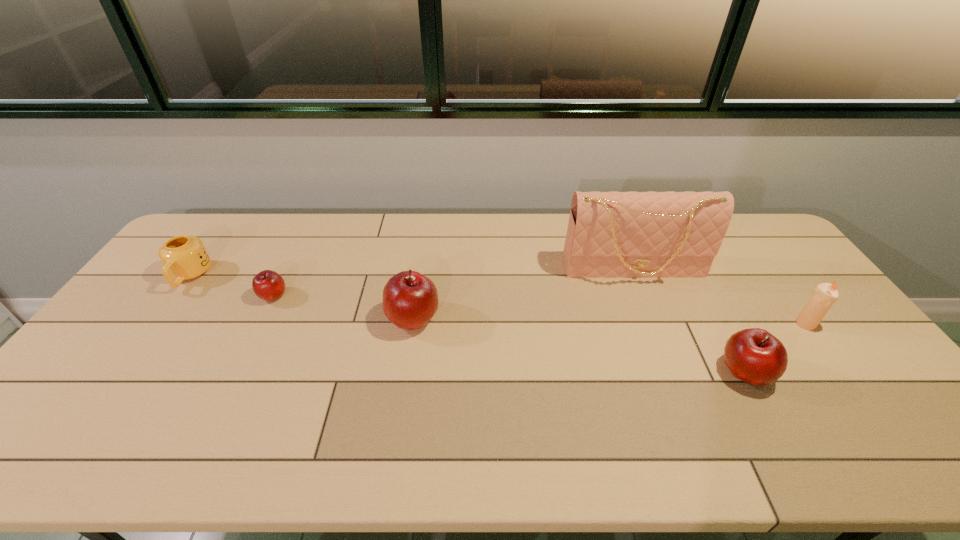
Image resolution: width=960 pixels, height=540 pixels. Find the location of `vacant space located 0.250m on the right of the fourth object from right to left`. vacant space located 0.250m on the right of the fourth object from right to left is located at coordinates (526, 318).

Locate an element on the screen. This screenshot has height=540, width=960. free spot located 0.360m on the left of the nearest object is located at coordinates (580, 372).

Find the location of a particular element. free space located 0.190m on the handle side of the leftmost object is located at coordinates (142, 342).

Locate an element on the screen. This screenshot has height=540, width=960. vacant space located 0.380m on the back of the candle is located at coordinates (743, 238).

The width and height of the screenshot is (960, 540). I want to click on vacant area situated on the front-facing side of the handbag, so click(x=666, y=353).

Identify the location of object that is at the near edge. (755, 356).

You are a GUI agent. You are given a task and a screenshot of the screen. Output one action in this format:
    pyautogui.click(x=<x>, y=<y>)
    Task: Click on the object located in the left edge section of the desktop
    The image size is (960, 540).
    Given the screenshot: What is the action you would take?
    pyautogui.click(x=184, y=257)

Identify the location of object located at the right edge. The height and width of the screenshot is (540, 960). (825, 295).

In the image, there is a desktop. Where is `vacant space at the far edge`? The height and width of the screenshot is (540, 960). vacant space at the far edge is located at coordinates (501, 231).

The image size is (960, 540). Identify the location of vacant region at the near edge of the desktop. (271, 392).